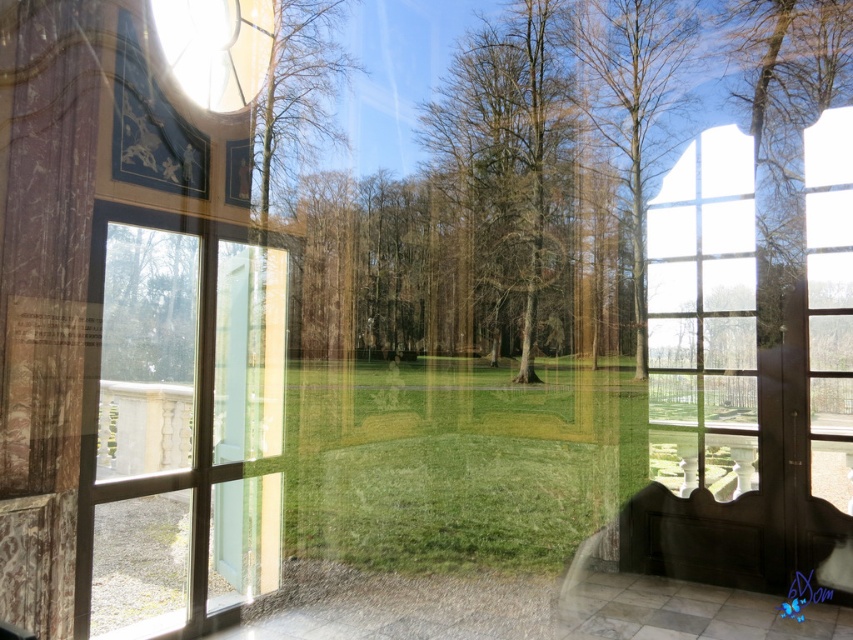
Question: Does clear glass door at left appear on the left side of clear glass window at center?

Choices:
 (A) no
 (B) yes

Answer: (B)

Question: Does clear glass door at left appear under clear glass window at center?

Choices:
 (A) yes
 (B) no

Answer: (A)

Question: Which of the following is the closest to the observer?

Choices:
 (A) clear glass window at center
 (B) clear glass door at left

Answer: (B)

Question: Which of the following is the closest to the observer?

Choices:
 (A) clear glass window at center
 (B) clear glass door at left

Answer: (B)

Question: Which object appears farthest from the camera in this image?

Choices:
 (A) clear glass window at center
 (B) green leafy tree at center

Answer: (B)

Question: Is clear glass door at left positioned behind clear glass window at center?

Choices:
 (A) yes
 (B) no

Answer: (B)